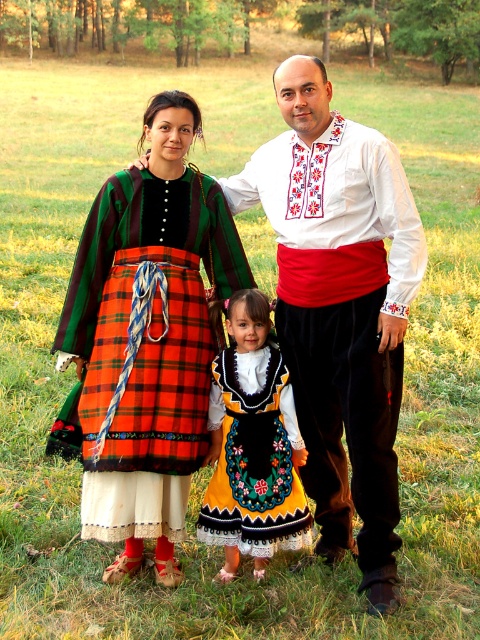
You are standing at the point marked by the coordinates point (186, 372). You want to walk towards the trees in the background. How far will you have to walk to reach the trees?

The distance between you and the trees is 11.79 feet.

You are a photographer setting up for a group photo. You need to ensure that the plaid fabric dress at center and the embroidered cotton dress at center are at least 15 inches apart to avoid overlapping in the frame. Based on the current spacing, will you need to adjust their positions?

The plaid fabric dress at center and embroidered cotton dress at center are currently 14.56 inches apart, which is less than the required 15 inches. Therefore, you should ask them to move slightly further apart to ensure they do not overlap in the photo.

Based on the coordinates provided, which object corresponds to the point at (339, 307)?

The point at (339, 307) corresponds to the matte plaid skirt at center.